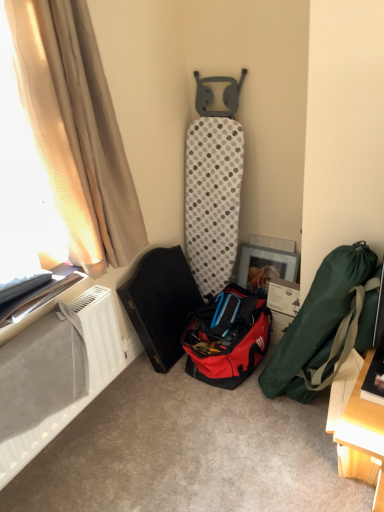
Question: From a real-world perspective, is green fabric bag at right, which is the 2th luggage and bags from left to right, physically above translucent beige curtain at left?

Choices:
 (A) yes
 (B) no

Answer: (B)

Question: Is green fabric bag at right, the 1th luggage and bags when ordered from right to left, positioned with its back to translucent beige curtain at left?

Choices:
 (A) no
 (B) yes

Answer: (A)

Question: Can you confirm if green fabric bag at right, which is the 2th luggage and bags from left to right, is wider than translucent beige curtain at left?

Choices:
 (A) yes
 (B) no

Answer: (B)

Question: Can you confirm if green fabric bag at right, the 1th luggage and bags when ordered from right to left, is bigger than translucent beige curtain at left?

Choices:
 (A) yes
 (B) no

Answer: (B)

Question: Is green fabric bag at right, which is the 2th luggage and bags from left to right, closer to the viewer compared to translucent beige curtain at left?

Choices:
 (A) no
 (B) yes

Answer: (A)

Question: Is green fabric bag at right, which is the 2th luggage and bags from left to right, smaller than translucent beige curtain at left?

Choices:
 (A) no
 (B) yes

Answer: (B)

Question: Does beige fabric curtain at left have a greater width compared to green fabric bag at right, which is the 2th luggage and bags from left to right?

Choices:
 (A) yes
 (B) no

Answer: (B)

Question: Does beige fabric curtain at left contain green fabric bag at right, the 1th luggage and bags when ordered from right to left?

Choices:
 (A) no
 (B) yes

Answer: (A)

Question: Is beige fabric curtain at left looking in the opposite direction of green fabric bag at right, the 1th luggage and bags when ordered from right to left?

Choices:
 (A) yes
 (B) no

Answer: (B)

Question: Is beige fabric curtain at left outside green fabric bag at right, which is the 2th luggage and bags from left to right?

Choices:
 (A) no
 (B) yes

Answer: (B)

Question: Does beige fabric curtain at left have a lesser width compared to green fabric bag at right, the 1th luggage and bags when ordered from right to left?

Choices:
 (A) yes
 (B) no

Answer: (A)

Question: Does beige fabric curtain at left turn towards green fabric bag at right, the 1th luggage and bags when ordered from right to left?

Choices:
 (A) yes
 (B) no

Answer: (A)

Question: Can you confirm if translucent beige curtain at left is smaller than red fabric bag at center, the 1th luggage and bags in the left-to-right sequence?

Choices:
 (A) yes
 (B) no

Answer: (B)